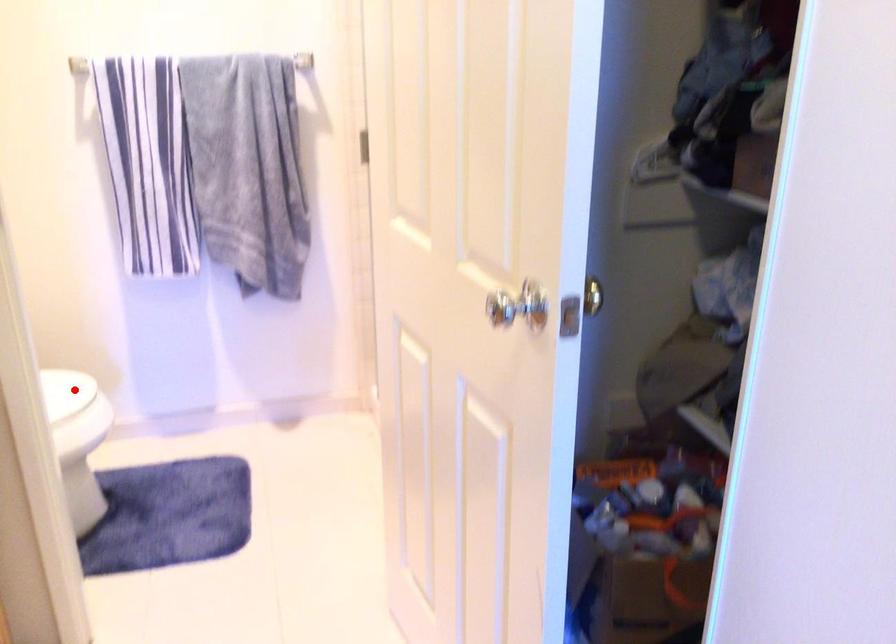
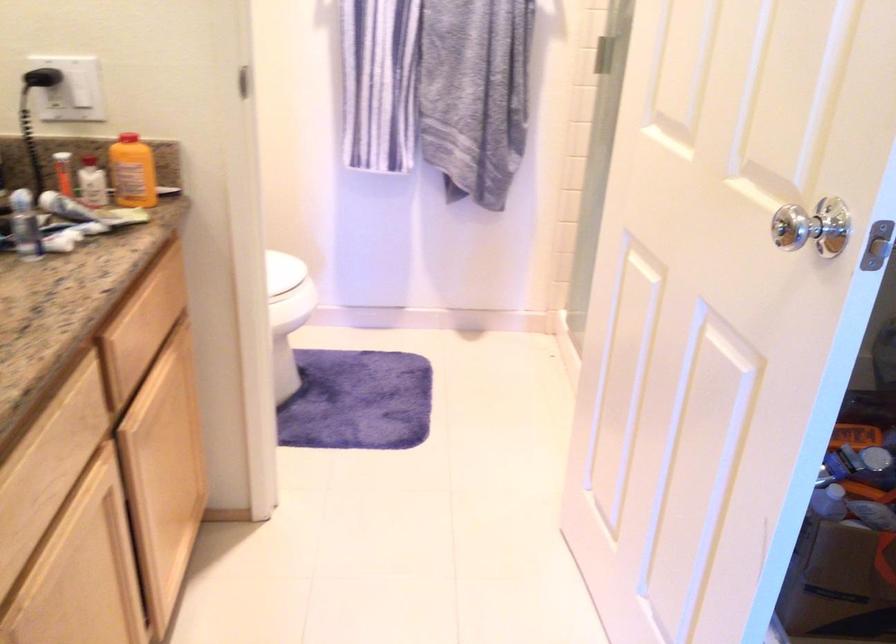
Question: I am providing you with two images of the same scene from different viewpoints. A red point is marked on the first image. At the location where the point appears in image 1, is it still visible in image 2?

Choices:
 (A) Yes
 (B) No

Answer: (A)